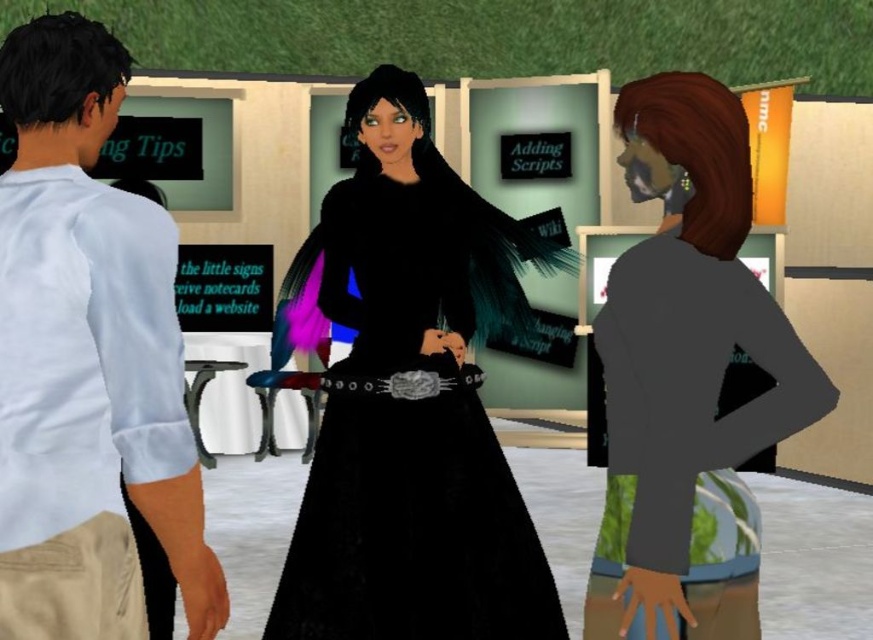
Question: Can you confirm if matte gray jacket at right is positioned above white cotton shirt at left?

Choices:
 (A) no
 (B) yes

Answer: (A)

Question: Which of the following is the closest to the observer?

Choices:
 (A) (476, 371)
 (B) (19, 104)
 (C) (418, 428)
 (D) (715, 365)

Answer: (B)

Question: Is white cotton shirt at left thinner than silver metallic belt at center?

Choices:
 (A) no
 (B) yes

Answer: (B)

Question: Which point is farther to the camera?

Choices:
 (A) white cotton shirt at left
 (B) silver metallic belt at center
 (C) matte gray jacket at right
 (D) black velvet dress at center

Answer: (B)

Question: Which point appears closest to the camera in this image?

Choices:
 (A) (59, 131)
 (B) (693, 403)
 (C) (320, 608)
 (D) (376, 394)

Answer: (A)

Question: Can you confirm if black velvet dress at center is wider than silver metallic belt at center?

Choices:
 (A) yes
 (B) no

Answer: (A)